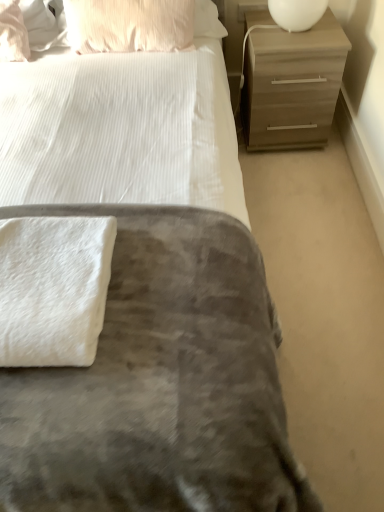
Where is `vacant area that is in front of white glossy lampshade at upper right`? This screenshot has height=512, width=384. vacant area that is in front of white glossy lampshade at upper right is located at coordinates (302, 44).